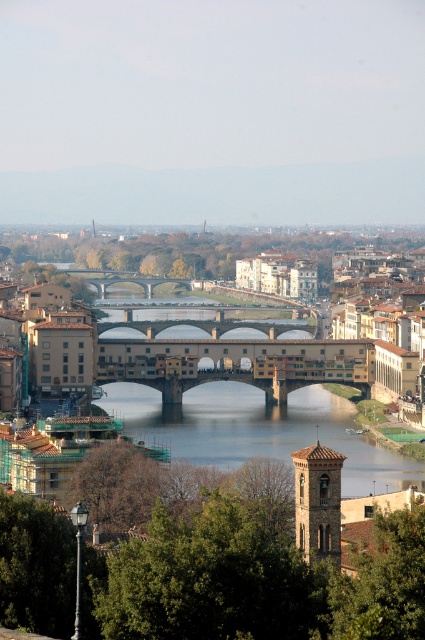
You are a tourist standing on the sidewalk near the brown stone bridge at center and want to cross the river. The clear water at bridge center flows under the bridge. If you want to cross the river, which object should you walk towards, and why?

You should walk towards the brown stone bridge at center because it spans across the river, allowing safe passage. The clear water at bridge center flows under the bridge, so walking towards the bridge provides a stable path to cross the river.